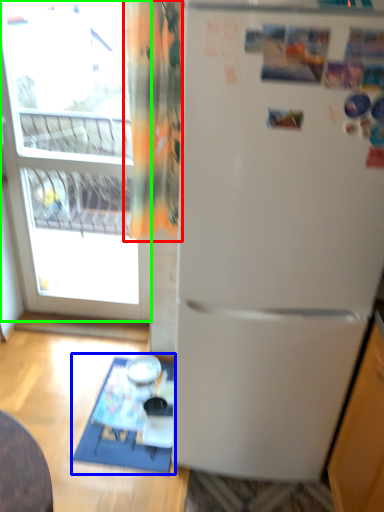
Question: Considering the real-world distances, which object is closest to curtain (highlighted by a red box)? table (highlighted by a blue box) or window (highlighted by a green box).

Choices:
 (A) table
 (B) window

Answer: (A)